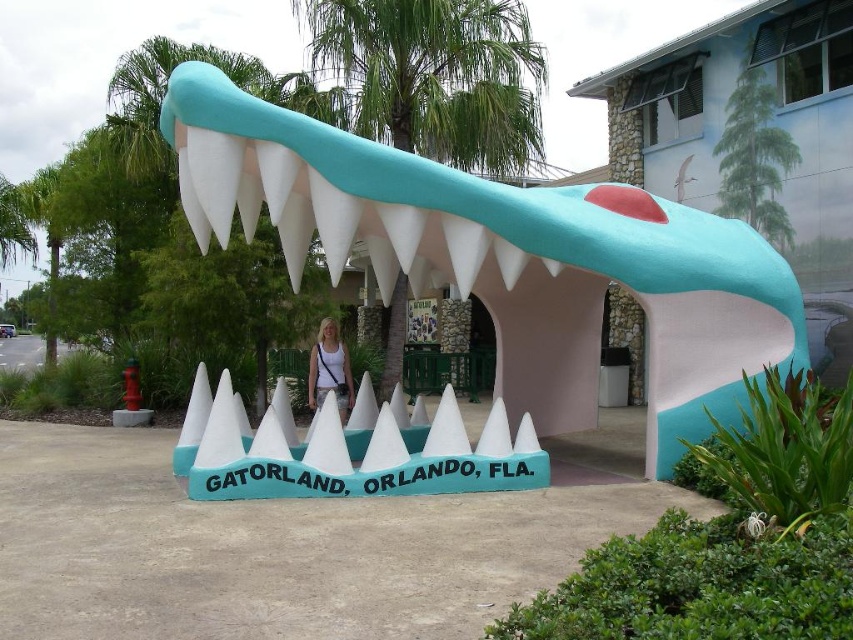
You are a landscape designer planning to place a new statue in a garden. You have the matte blue sculpture at center and the green leafy palm tree at center in your design. Based on their sizes, which object should you place closer to the garden entrance for better visibility?

The matte blue sculpture at center should be placed closer to the garden entrance because it occupies less space than the green leafy palm tree at center, making it more suitable for prominent placement where visibility is key.

You are visiting Gatorland and want to take a photo with the crocodile sculpture. You notice a green leafy palm tree at center and a white fabric shirt at center. Which object is wider when viewed from your position?

The green leafy palm tree at center is wider than the white fabric shirt at center.